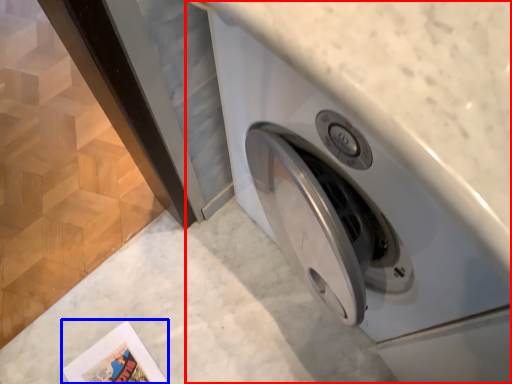
Question: Which object appears closest to the camera in this image, washing machine (highlighted by a red box) or comic book (highlighted by a blue box)?

Choices:
 (A) washing machine
 (B) comic book

Answer: (A)